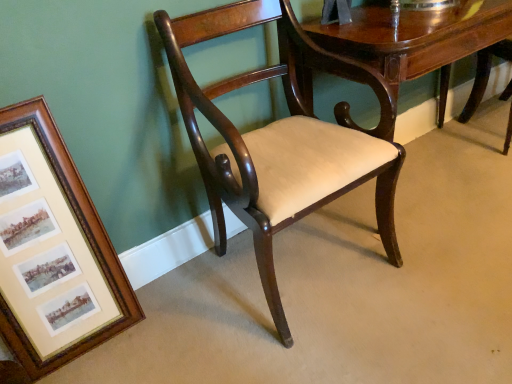
At what (x,y) coordinates should I click in order to perform the action: click on free space between mahogany wood chair at center and mahogany wood table at center. Please return your answer as a coordinate pair (x, y). Looking at the image, I should click on (439, 216).